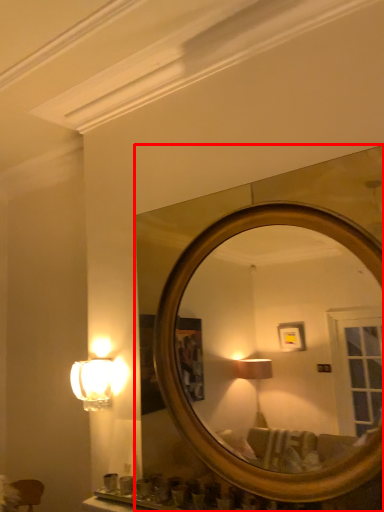
Question: Where is mirror (annotated by the red box) located in relation to lamp in the image?

Choices:
 (A) left
 (B) right

Answer: (B)